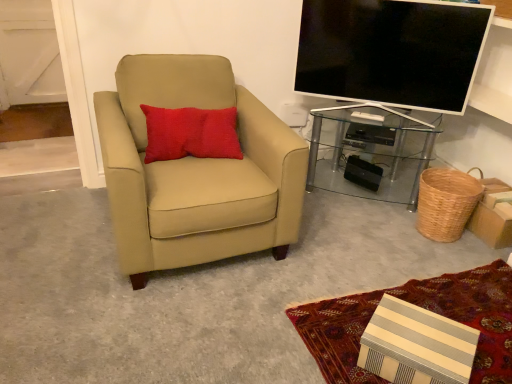
The height and width of the screenshot is (384, 512). In order to click on vacant space in front of beige leather chair at left in this screenshot , I will do `click(158, 319)`.